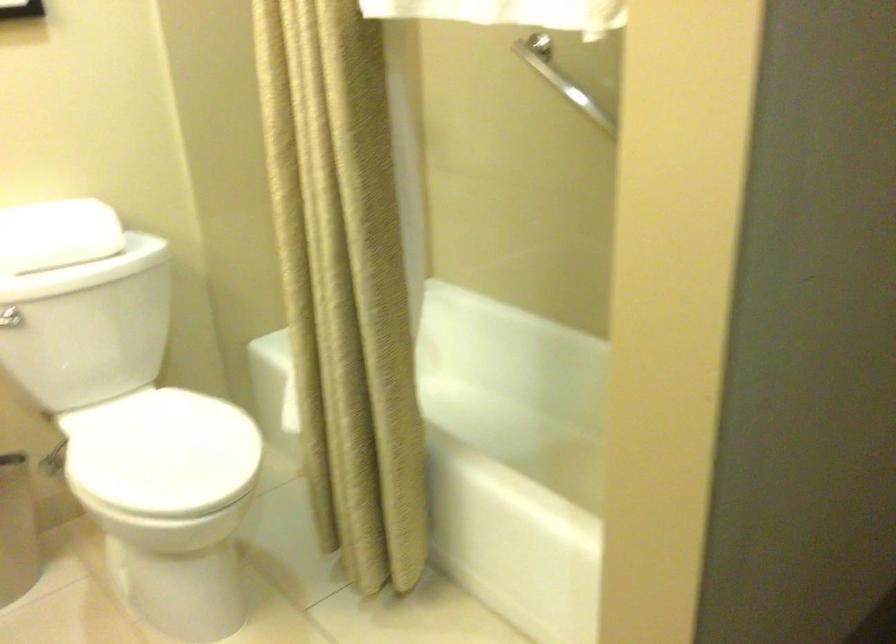
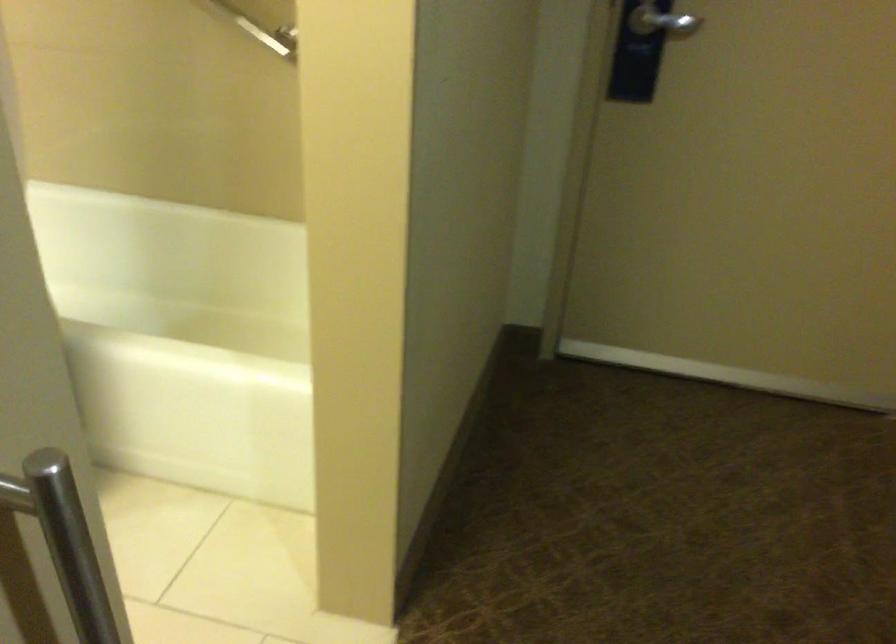
Question: The first image is from the beginning of the video and the second image is from the end. How did the camera likely rotate when shooting the video?

Choices:
 (A) Left
 (B) Right
 (C) Up
 (D) Down

Answer: (B)